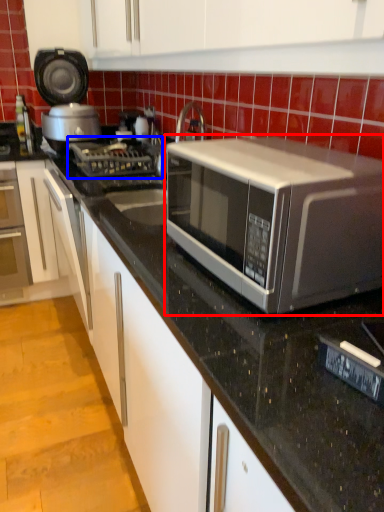
Question: Which object is closer to the camera taking this photo, microwave oven (highlighted by a red box) or gas stove (highlighted by a blue box)?

Choices:
 (A) microwave oven
 (B) gas stove

Answer: (A)